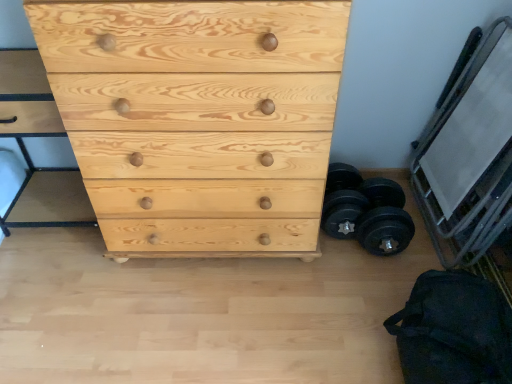
Question: From a real-world perspective, is metallic silver bunk bed at right on black fabric bag at lower right?

Choices:
 (A) yes
 (B) no

Answer: (A)

Question: Considering the relative sizes of metallic silver bunk bed at right and black fabric bag at lower right in the image provided, is metallic silver bunk bed at right thinner than black fabric bag at lower right?

Choices:
 (A) yes
 (B) no

Answer: (A)

Question: Considering the relative sizes of metallic silver bunk bed at right and black fabric bag at lower right in the image provided, is metallic silver bunk bed at right wider than black fabric bag at lower right?

Choices:
 (A) no
 (B) yes

Answer: (A)

Question: Is black fabric bag at lower right a part of metallic silver bunk bed at right?

Choices:
 (A) yes
 (B) no

Answer: (B)

Question: Does metallic silver bunk bed at right have a greater height compared to black fabric bag at lower right?

Choices:
 (A) yes
 (B) no

Answer: (A)

Question: Is metallic silver bunk bed at right turned away from black fabric bag at lower right?

Choices:
 (A) no
 (B) yes

Answer: (A)

Question: From a real-world perspective, is black fabric bag at lower right physically above metallic silver bunk bed at right?

Choices:
 (A) yes
 (B) no

Answer: (B)

Question: Considering the relative sizes of black fabric bag at lower right and metallic silver bunk bed at right in the image provided, is black fabric bag at lower right thinner than metallic silver bunk bed at right?

Choices:
 (A) yes
 (B) no

Answer: (B)

Question: From a real-world perspective, is black fabric bag at lower right beneath metallic silver bunk bed at right?

Choices:
 (A) yes
 (B) no

Answer: (A)

Question: Considering the relative sizes of black fabric bag at lower right and metallic silver bunk bed at right in the image provided, is black fabric bag at lower right smaller than metallic silver bunk bed at right?

Choices:
 (A) no
 (B) yes

Answer: (B)

Question: Is black fabric bag at lower right aimed at metallic silver bunk bed at right?

Choices:
 (A) yes
 (B) no

Answer: (B)

Question: Does black fabric bag at lower right appear on the left side of metallic silver bunk bed at right?

Choices:
 (A) yes
 (B) no

Answer: (A)

Question: Is metallic silver bunk bed at right positioned with its back to black rubber dumbbell at lower right?

Choices:
 (A) yes
 (B) no

Answer: (B)